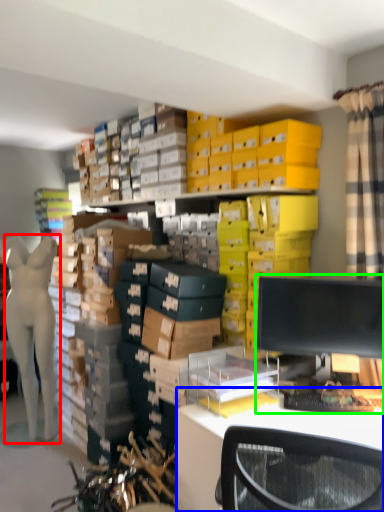
Question: Which is farther away from person (highlighted by a red box)? desk (highlighted by a blue box) or desktop computer (highlighted by a green box)?

Choices:
 (A) desk
 (B) desktop computer

Answer: (B)